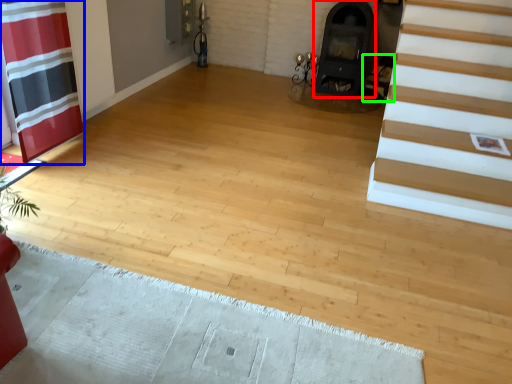
Question: Which object is positioned farthest from fireplace (highlighted by a red box)? Select from curtain (highlighted by a blue box) and armchair (highlighted by a green box).

Choices:
 (A) curtain
 (B) armchair

Answer: (A)